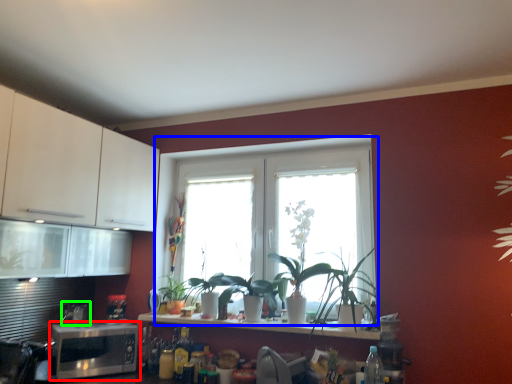
Question: Considering the real-world distances, which object is closest to microwave oven (highlighted by a red box)? window (highlighted by a blue box) or appliance (highlighted by a green box).

Choices:
 (A) window
 (B) appliance

Answer: (B)